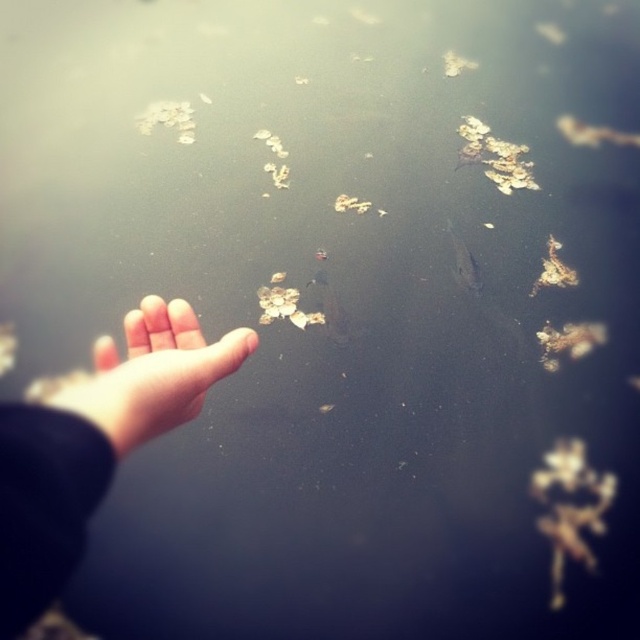
Question: From the image, what is the correct spatial relationship of pale skin hand at lower left in relation to brown leafy debris at upper center?

Choices:
 (A) right
 (B) left

Answer: (B)

Question: Which point is farther to the camera?

Choices:
 (A) brown organic matter at center
 (B) pale skin hand at lower left
 (C) skinny flesh at left
 (D) brown leafy debris at upper center

Answer: (D)

Question: Which point is farther from the camera taking this photo?

Choices:
 (A) (460, 164)
 (B) (99, 416)

Answer: (A)

Question: Which of the following is the farthest from the observer?

Choices:
 (A) (552, 259)
 (B) (170, 401)
 (C) (237, 348)

Answer: (A)

Question: Is brown leafy debris at upper center smaller than brown organic matter at center?

Choices:
 (A) yes
 (B) no

Answer: (B)

Question: Is pale skin hand at lower left below brown organic matter at center?

Choices:
 (A) no
 (B) yes

Answer: (B)